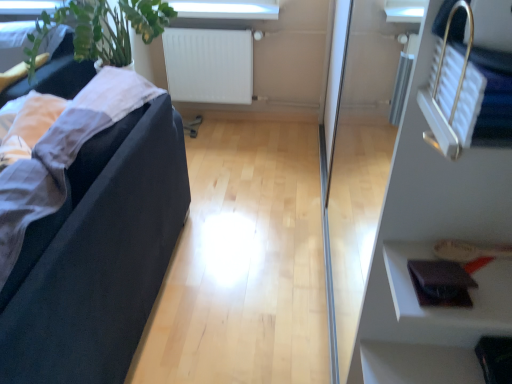
Image resolution: width=512 pixels, height=384 pixels. Identify the location of leather wallet at lower right. (451, 309).

Is leather wallet at lower right facing away from white matte radiator at upper center?

Yes, white matte radiator at upper center is at the back of leather wallet at lower right.

Is leather wallet at lower right taller than white matte radiator at upper center?

Incorrect, the height of leather wallet at lower right is not larger of that of white matte radiator at upper center.

This screenshot has width=512, height=384. I want to click on shelf located in front of the white matte radiator at upper center, so click(451, 309).

Does point (445, 314) appear closer or farther from the camera than point (221, 83)?

Point (445, 314) appears to be closer to the viewer than point (221, 83).

Which object is positioned more to the left, white matte radiator at upper center or leather wallet at lower right?

white matte radiator at upper center.

Measure the distance from white matte radiator at upper center to leather wallet at lower right.

white matte radiator at upper center and leather wallet at lower right are 7.86 feet apart.

Can you confirm if white matte radiator at upper center is bigger than leather wallet at lower right?

Yes, white matte radiator at upper center is bigger than leather wallet at lower right.

Is point (249, 68) less distant than point (402, 255)?

No, it is behind (402, 255).

Which object is positioned more to the right, black fabric couch at left or white matte radiator at upper center?

From the viewer's perspective, white matte radiator at upper center appears more on the right side.

Consider the image. From the image's perspective, who appears lower, black fabric couch at left or white matte radiator at upper center?

black fabric couch at left, from the image's perspective.

Does point (234, 73) come behind point (113, 346)?

Yes, it is behind point (113, 346).

Consider the image. Considering the sizes of objects white matte radiator at upper center and black fabric couch at left in the image provided, who is shorter, white matte radiator at upper center or black fabric couch at left?

With less height is white matte radiator at upper center.

Does white matte radiator at upper center have a lesser width compared to black fabric couch at left?

Yes.

Is white matte radiator at upper center further to the viewer compared to black fabric couch at left?

Yes, white matte radiator at upper center is further from the viewer.

Based on the photo, considering the sizes of leather wallet at lower right and black fabric couch at left in the image, is leather wallet at lower right wider or thinner than black fabric couch at left?

Considering their sizes, leather wallet at lower right looks slimmer than black fabric couch at left.

Considering the positions of objects leather wallet at lower right and black fabric couch at left in the image provided, who is behind, leather wallet at lower right or black fabric couch at left?

leather wallet at lower right is further away from the camera.

Who is taller, leather wallet at lower right or black fabric couch at left?

Standing taller between the two is black fabric couch at left.

Is leather wallet at lower right situated inside black fabric couch at left or outside?

leather wallet at lower right exists outside the volume of black fabric couch at left.

Between leather wallet at lower right and transparent glass door at right, which one is positioned in front?

transparent glass door at right.

Considering the positions of objects leather wallet at lower right and transparent glass door at right in the image provided, who is more to the left, leather wallet at lower right or transparent glass door at right?

transparent glass door at right is more to the left.

Can you tell me how much leather wallet at lower right and transparent glass door at right differ in facing direction?

95 degrees separate the facing orientations of leather wallet at lower right and transparent glass door at right.

Which point is more forward, (407, 311) or (372, 220)?

The point (407, 311) is closer.

Identify the location of shelf below the transparent glass door at right (from the image's perspective). (451, 309).

Which of these two, transparent glass door at right or leather wallet at lower right, is bigger?

Bigger between the two is transparent glass door at right.

Is transparent glass door at right not within leather wallet at lower right?

That's correct, transparent glass door at right is outside of leather wallet at lower right.

Considering the sizes of objects transparent glass door at right and leather wallet at lower right in the image provided, who is thinner, transparent glass door at right or leather wallet at lower right?

transparent glass door at right.

I want to click on shelf to the right of white matte radiator at upper center, so click(x=451, y=309).

Identify the location of shelf above the white matte radiator at upper center (from a real-world perspective). The width and height of the screenshot is (512, 384). (451, 309).

Estimate the real-world distances between objects in this image. Which object is closer to leather wallet at lower right, black fabric couch at left or white matte radiator at upper center?

black fabric couch at left lies closer to leather wallet at lower right than the other object.

Based on their spatial positions, is black fabric couch at left or white matte radiator at upper center further from transparent glass door at right?

The object further to transparent glass door at right is black fabric couch at left.

From the picture: Estimate the real-world distances between objects in this image. Which object is closer to leather wallet at lower right, white matte radiator at upper center or black fabric couch at left?

black fabric couch at left is closer to leather wallet at lower right.

Looking at the image, which one is located closer to black fabric couch at left, white matte radiator at upper center or transparent glass door at right?

transparent glass door at right lies closer to black fabric couch at left than the other object.

Which object lies further to the anchor point white matte radiator at upper center, leather wallet at lower right or transparent glass door at right?

The object further to white matte radiator at upper center is leather wallet at lower right.

When comparing their distances from transparent glass door at right, does white matte radiator at upper center or black fabric couch at left seem closer?

The object closer to transparent glass door at right is white matte radiator at upper center.

Based on their spatial positions, is transparent glass door at right or leather wallet at lower right further from black fabric couch at left?

The object further to black fabric couch at left is transparent glass door at right.

From the image, which object appears to be nearer to black fabric couch at left, transparent glass door at right or white matte radiator at upper center?

Among the two, transparent glass door at right is located nearer to black fabric couch at left.

In order to click on glass door between black fabric couch at left and leather wallet at lower right in this screenshot , I will do `click(356, 162)`.

Where is `shelf between black fabric couch at left and white matte radiator at upper center from front to back`? shelf between black fabric couch at left and white matte radiator at upper center from front to back is located at coordinates (451, 309).

At what (x,y) coordinates should I click in order to perform the action: click on studio couch between transparent glass door at right and white matte radiator at upper center from front to back. Please return your answer as a coordinate pair (x, y). The height and width of the screenshot is (384, 512). Looking at the image, I should click on (98, 255).

The width and height of the screenshot is (512, 384). In order to click on shelf positioned between transparent glass door at right and white matte radiator at upper center from near to far in this screenshot , I will do `click(451, 309)`.